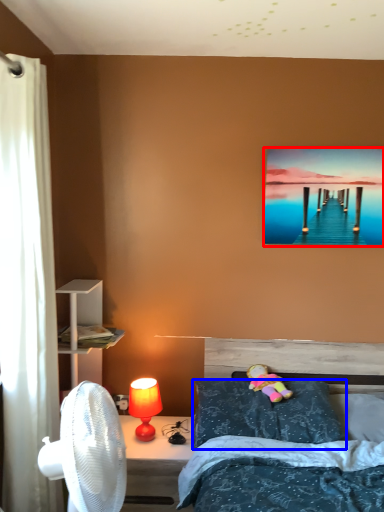
Question: Among these objects, which one is farthest to the camera, picture frame (highlighted by a red box) or pillow (highlighted by a blue box)?

Choices:
 (A) picture frame
 (B) pillow

Answer: (A)